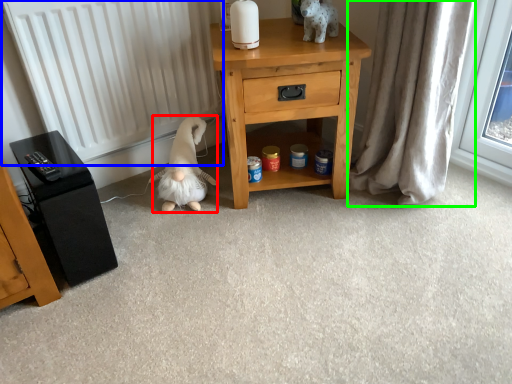
Question: Based on their relative distances, which object is farther from animal (highlighted by a red box)? Choose from radiator (highlighted by a blue box) and curtain (highlighted by a green box).

Choices:
 (A) radiator
 (B) curtain

Answer: (B)